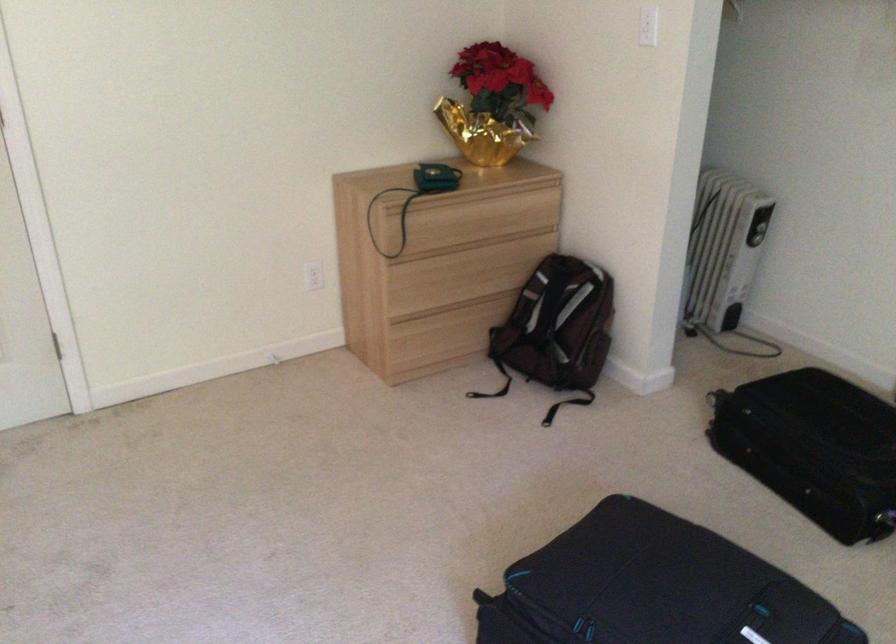
Locate an element on the screen. The image size is (896, 644). gold flower pot is located at coordinates (493, 104).